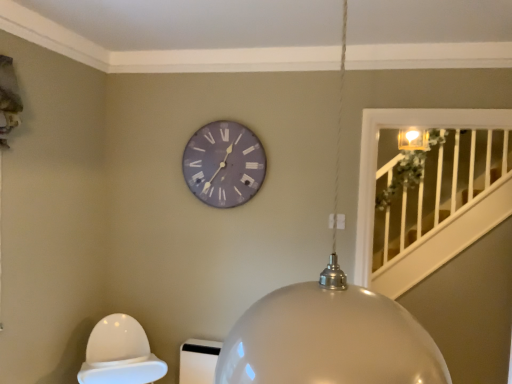
Question: Is purple matte clock at upper center a part of glossy metallic globe at center?

Choices:
 (A) yes
 (B) no

Answer: (B)

Question: Can we say glossy metallic globe at center lies outside purple matte clock at upper center?

Choices:
 (A) yes
 (B) no

Answer: (A)

Question: Is glossy metallic globe at center to the right of purple matte clock at upper center from the viewer's perspective?

Choices:
 (A) no
 (B) yes

Answer: (B)

Question: Is glossy metallic globe at center facing towards purple matte clock at upper center?

Choices:
 (A) no
 (B) yes

Answer: (A)

Question: Is the position of glossy metallic globe at center more distant than that of purple matte clock at upper center?

Choices:
 (A) no
 (B) yes

Answer: (A)

Question: Considering the relative sizes of glossy metallic globe at center and purple matte clock at upper center in the image provided, is glossy metallic globe at center bigger than purple matte clock at upper center?

Choices:
 (A) no
 (B) yes

Answer: (B)

Question: Does purple matte clock at upper center turn towards glossy metallic globe at center?

Choices:
 (A) no
 (B) yes

Answer: (B)

Question: Is purple matte clock at upper center far from glossy metallic globe at center?

Choices:
 (A) no
 (B) yes

Answer: (B)

Question: Is purple matte clock at upper center next to glossy metallic globe at center?

Choices:
 (A) no
 (B) yes

Answer: (A)

Question: Does purple matte clock at upper center have a lesser width compared to glossy metallic globe at center?

Choices:
 (A) yes
 (B) no

Answer: (A)

Question: Is purple matte clock at upper center positioned before glossy metallic globe at center?

Choices:
 (A) no
 (B) yes

Answer: (A)

Question: Is purple matte clock at upper center located outside glossy metallic globe at center?

Choices:
 (A) yes
 (B) no

Answer: (A)

Question: Is purple matte clock at upper center inside or outside of glossy metallic globe at center?

Choices:
 (A) inside
 (B) outside

Answer: (B)